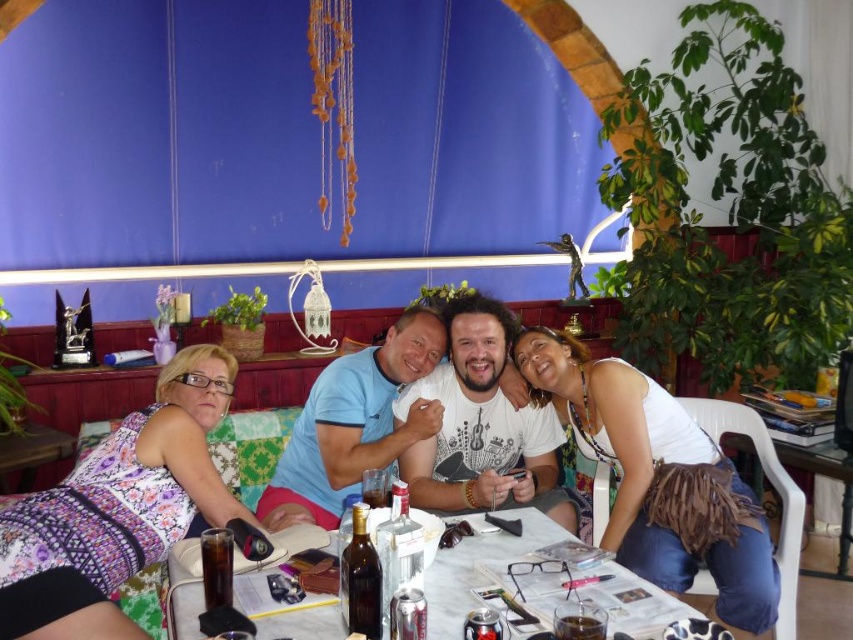
Does white tank top at center lie behind blue cotton shirt at center?

No.

Is point (735, 579) farther from viewer compared to point (439, 422)?

No.

Which is behind, point (670, 400) or point (393, 340)?

The point (393, 340) is behind.

This screenshot has width=853, height=640. What are the coordinates of `white tank top at center` in the screenshot? It's located at (659, 480).

Does purple printed dress at lower left lie in front of white cotton t-shirt at center?

Yes.

Can you confirm if purple printed dress at lower left is positioned to the left of white cotton t-shirt at center?

Indeed, purple printed dress at lower left is positioned on the left side of white cotton t-shirt at center.

Is point (15, 632) behind point (439, 372)?

That is False.

Image resolution: width=853 pixels, height=640 pixels. I want to click on purple printed dress at lower left, so click(119, 508).

Which is in front, point (349, 410) or point (442, 580)?

Point (442, 580) is more forward.

Who is positioned more to the left, blue cotton shirt at center or white marble table at center?

blue cotton shirt at center

Find the location of `blue cotton shirt at center`. blue cotton shirt at center is located at coordinates (352, 422).